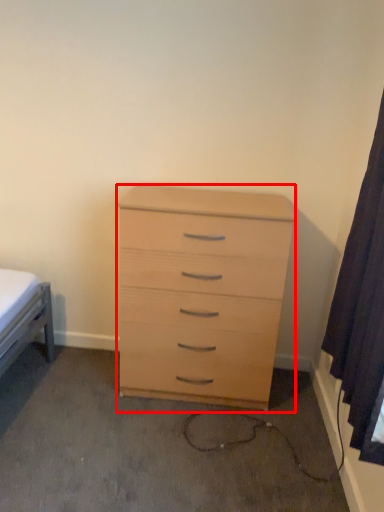
Question: From the image's perspective, where is chest of drawers (annotated by the red box) located in relation to curtain in the image?

Choices:
 (A) below
 (B) above

Answer: (A)